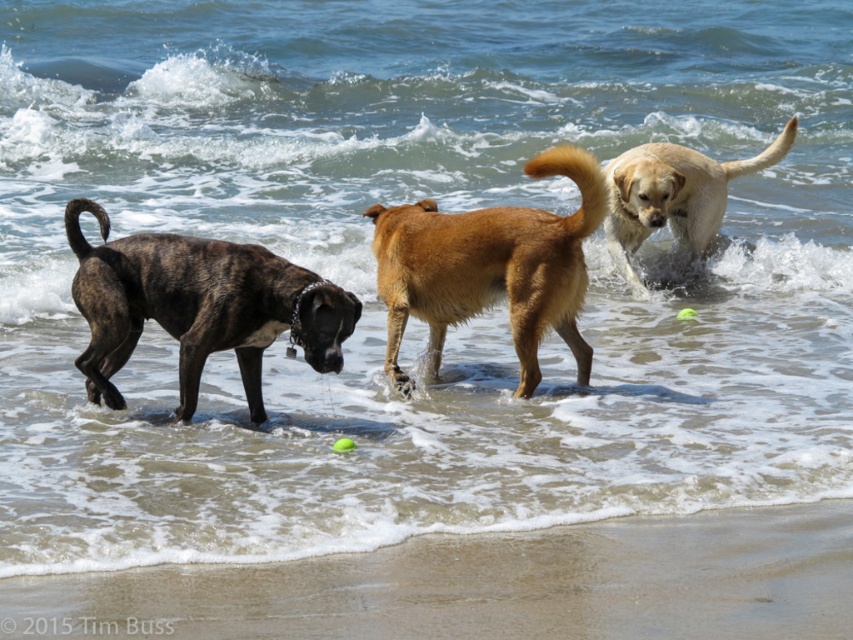
Who is more forward, (103, 264) or (613, 179)?

Point (103, 264) is in front.

Who is more forward, (218,332) or (628,236)?

Point (218,332) is in front.

Image resolution: width=853 pixels, height=640 pixels. Identify the location of brindle fur dog at left. (198, 307).

Where is `sandy beach at lower center`? The image size is (853, 640). sandy beach at lower center is located at coordinates (489, 586).

Does sandy beach at lower center lie behind light brown fur dog at right?

No, sandy beach at lower center is closer to the viewer.

Describe the element at coordinates (489, 586) in the screenshot. I see `sandy beach at lower center` at that location.

Locate an element on the screen. sandy beach at lower center is located at coordinates (489, 586).

Can you confirm if golden fur dog at center is wider than light brown fur dog at right?

No.

Who is taller, golden fur dog at center or light brown fur dog at right?

light brown fur dog at right is taller.

Image resolution: width=853 pixels, height=640 pixels. What are the coordinates of `golden fur dog at center` in the screenshot? It's located at (490, 268).